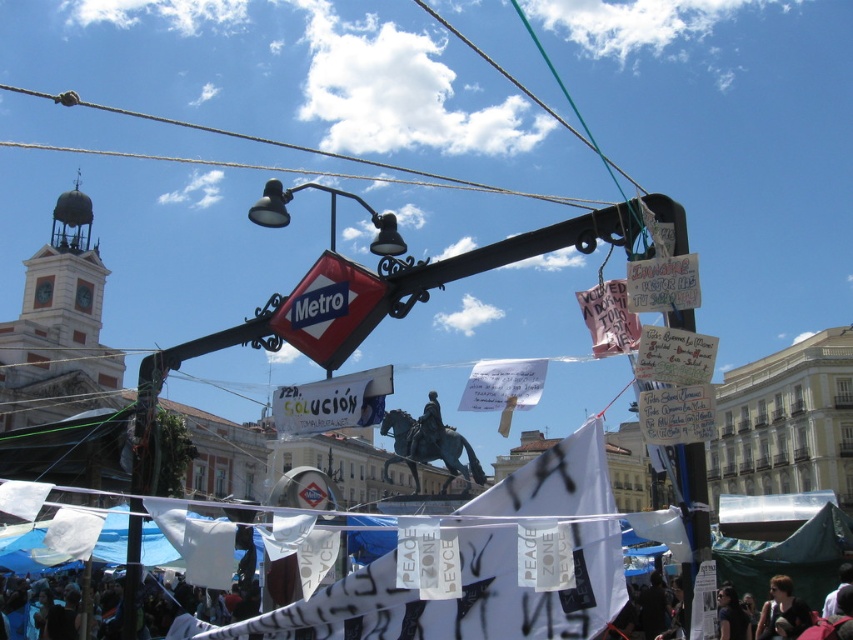
Which is below, red plastic metro sign at center or bronze statue of a man on horseback at center?

Positioned lower is bronze statue of a man on horseback at center.

Which is more to the left, red plastic metro sign at center or bronze statue of a man on horseback at center?

From the viewer's perspective, red plastic metro sign at center appears more on the left side.

Between point (317, 288) and point (433, 394), which one is positioned in front?

Point (317, 288) is more forward.

Identify the location of red plastic metro sign at center. (329, 308).

Can you confirm if blonde hair at lower right is positioned to the right of dark hair at lower right?

Indeed, blonde hair at lower right is positioned on the right side of dark hair at lower right.

Is point (775, 634) in front of point (729, 588)?

Yes, it is in front of point (729, 588).

Locate an element on the screen. The width and height of the screenshot is (853, 640). blonde hair at lower right is located at coordinates tap(782, 612).

How far apart are red plastic metro sign at center and dark hair at lower right?

red plastic metro sign at center is 97.68 feet away from dark hair at lower right.

Does red plastic metro sign at center come in front of dark hair at lower right?

Yes, it is in front of dark hair at lower right.

Does point (320, 346) lie in front of point (726, 628)?

That is True.

Identify the location of red plastic metro sign at center. (329, 308).